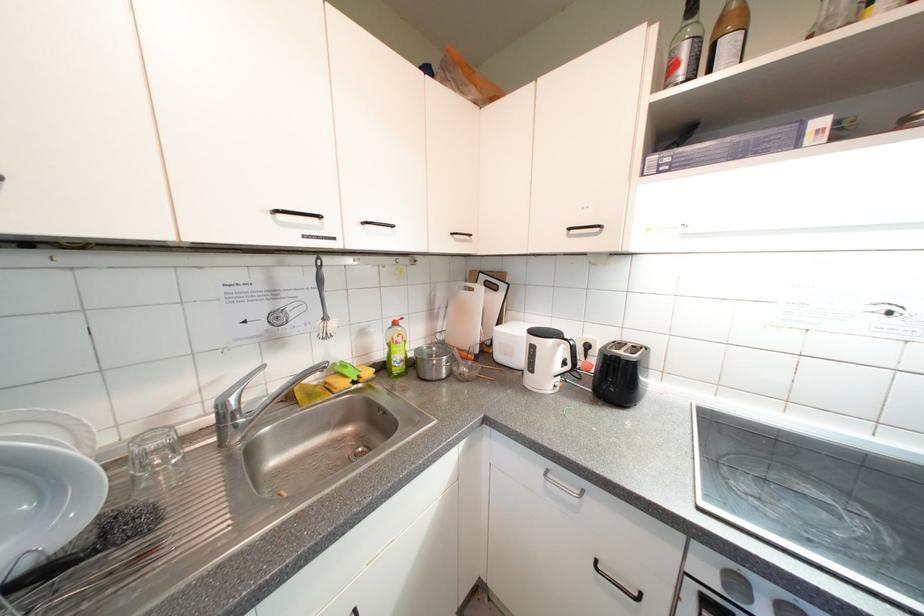
Identify the location of faucet lever. (249, 405).